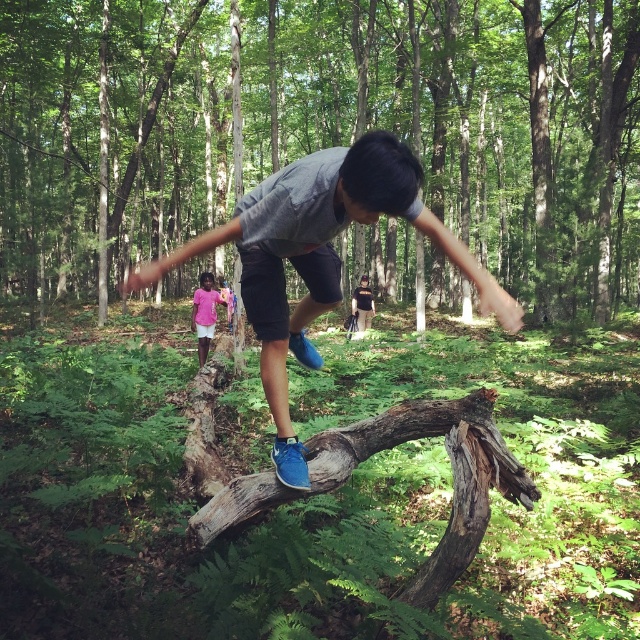
Question: Is blue suede sneakers at center positioned at the back of pink fabric dress at center?

Choices:
 (A) yes
 (B) no

Answer: (B)

Question: Is brown rough log at center further to the viewer compared to pink fabric dress at center?

Choices:
 (A) yes
 (B) no

Answer: (A)

Question: Is brown rough log at center positioned before blue suede sneakers at center?

Choices:
 (A) no
 (B) yes

Answer: (A)

Question: Which object appears farthest from the camera in this image?

Choices:
 (A) brown rough log at center
 (B) blue suede sneakers at center
 (C) dark brown leather backpack at center

Answer: (C)

Question: Among these points, which one is farthest from the camera?

Choices:
 (A) (205, 273)
 (B) (292, 476)

Answer: (A)

Question: Which point is farther to the camera?

Choices:
 (A) (353, 182)
 (B) (198, 349)

Answer: (B)